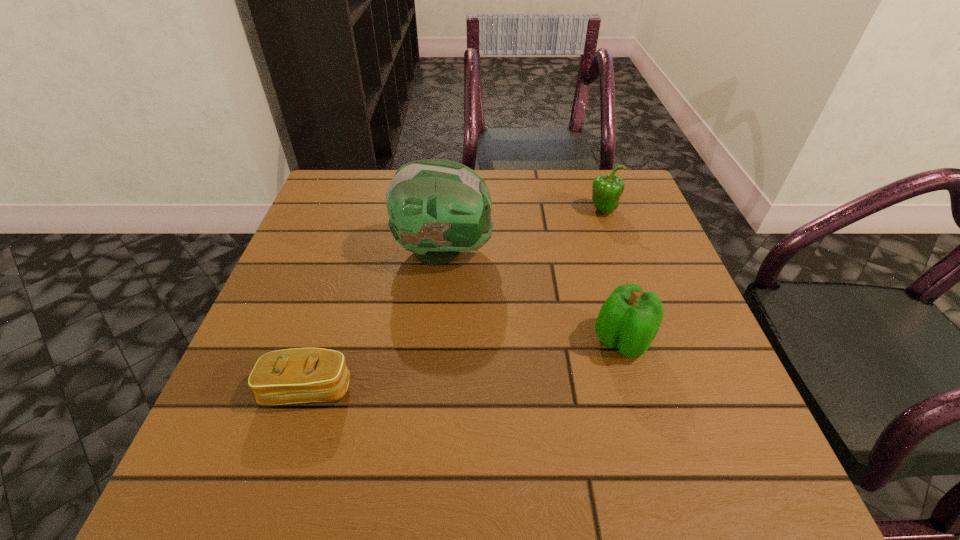
In the image, there is a desktop. What are the coordinates of `free space at the near right corner` in the screenshot? It's located at (774, 475).

Locate an element on the screen. Image resolution: width=960 pixels, height=540 pixels. empty location between the nearer bell pepper and the nearest object is located at coordinates (465, 365).

Where is `unoccupied position between the tallest object and the clutch bag`? Image resolution: width=960 pixels, height=540 pixels. unoccupied position between the tallest object and the clutch bag is located at coordinates (376, 320).

At what (x,y) coordinates should I click in order to perform the action: click on empty space between the third farthest object and the nearest object. Please return your answer as a coordinate pair (x, y). This screenshot has height=540, width=960. Looking at the image, I should click on (465, 365).

Locate an element on the screen. empty space that is in between the tallest object and the third farthest object is located at coordinates (533, 296).

Image resolution: width=960 pixels, height=540 pixels. I want to click on vacant region between the nearer bell pepper and the shortest object, so click(x=465, y=365).

At what (x,y) coordinates should I click in order to perform the action: click on free area in between the second nearest object and the tallest object. Please return your answer as a coordinate pair (x, y). Looking at the image, I should click on (533, 296).

This screenshot has width=960, height=540. In order to click on empty space between the shortest object and the farthest object in this screenshot , I will do `click(455, 300)`.

Locate an element on the screen. This screenshot has height=540, width=960. vacant space that's between the third object from right to left and the farthest object is located at coordinates (523, 231).

Where is `free spot between the leftmost object and the third object from right to left`? free spot between the leftmost object and the third object from right to left is located at coordinates (376, 320).